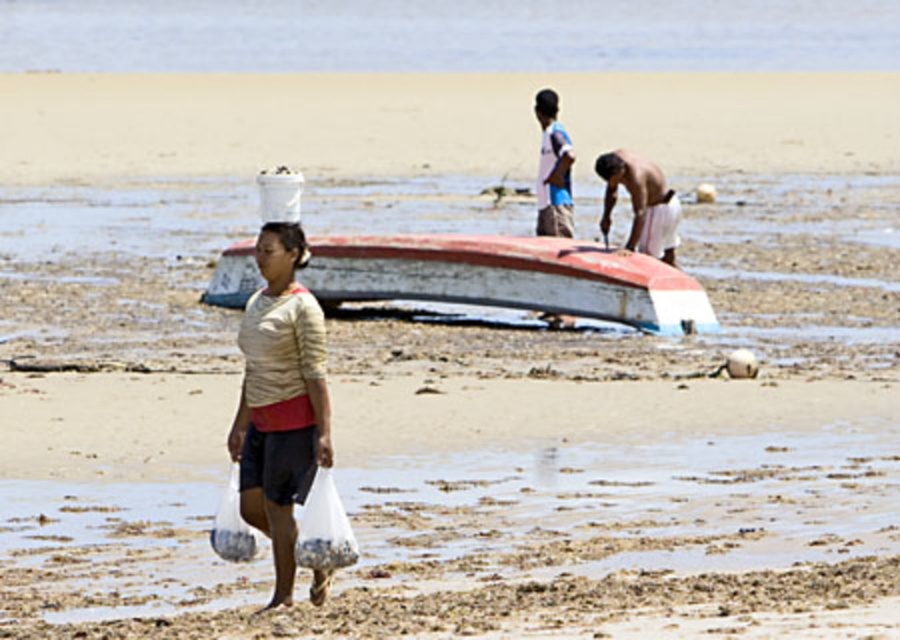
Question: Does matte beige shirt at center appear over shiny white sand at center?

Choices:
 (A) yes
 (B) no

Answer: (B)

Question: Which of the following is the farthest from the observer?

Choices:
 (A) rusty wood boat at center
 (B) light blue fabric shirt at center
 (C) shiny white sand at center

Answer: (C)

Question: Which point is closer to the camera?

Choices:
 (A) (549, 177)
 (B) (644, 224)

Answer: (B)

Question: Among these points, which one is farthest from the camera?

Choices:
 (A) (267, 420)
 (B) (343, 17)

Answer: (B)

Question: Can you confirm if clear water at upper left is wider than rusty wood boat at center?

Choices:
 (A) yes
 (B) no

Answer: (A)

Question: Can you confirm if clear water at upper left is positioned below matte beige shirt at center?

Choices:
 (A) no
 (B) yes

Answer: (A)